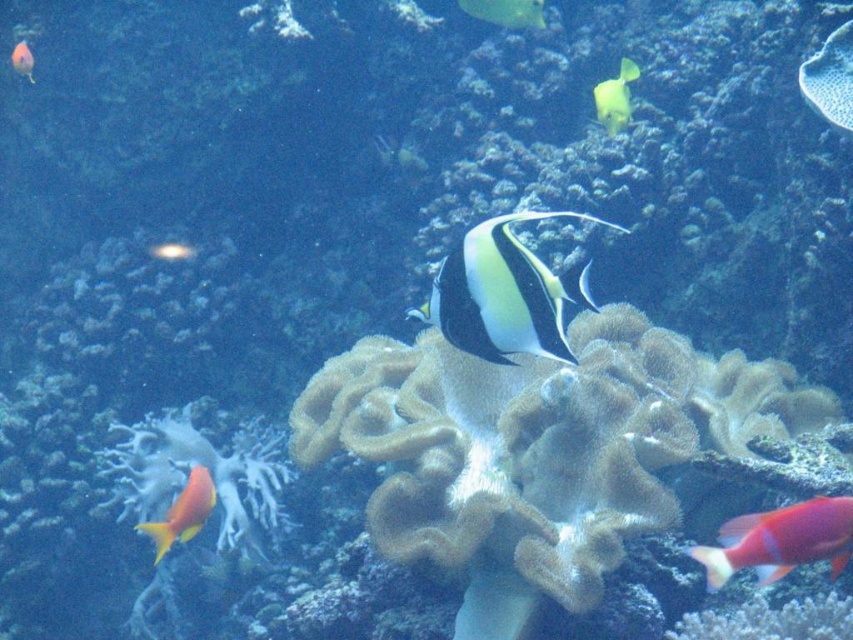
You are a marine biologist studying the spatial distribution of fish in this underwater scene. You need to locate the matte orange fish at upper left for your research. What are its coordinates in the image?

The matte orange fish at upper left is located at coordinates point (22, 60).

You are a marine biologist observing the underwater scene. You notice the black glossy fish at center and the matte orange fish at upper left. Which fish is located to the right of the other?

The black glossy fish at center is positioned on the right side of the matte orange fish at upper left.

You are a marine biologist observing this underwater scene. You need to determine if the distance between the matte orange fish at upper left and the yellow and black striped fish at center is sufficient for a robotic submarine to navigate between them. The submarine requires at least 20 inches of space to move safely. Can the submarine safely pass between them?

The distance between the matte orange fish at upper left and the yellow and black striped fish at center is 24.39 inches, which is more than the required 20 inches. Therefore, the robotic submarine can safely navigate between them.